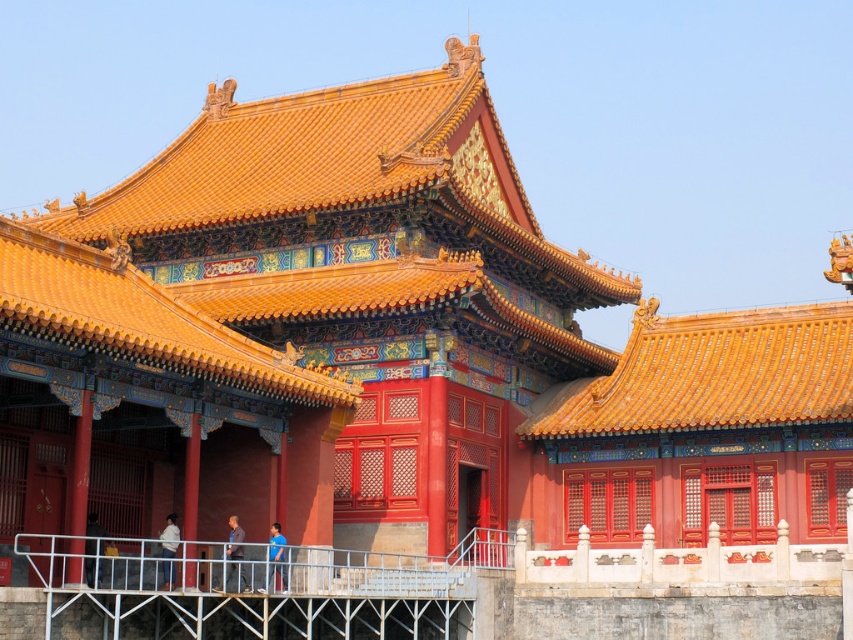
Question: Which point appears closest to the camera in this image?

Choices:
 (A) (260, 588)
 (B) (305, 550)
 (C) (167, 531)
 (D) (229, 556)

Answer: (A)

Question: Which is farther from the metallic gray railing at lower center?

Choices:
 (A) dark blue shirt at center
 (B) white fabric at lower left
 (C) blue fabric shirt at center
 (D) matte black person at lower left

Answer: (A)

Question: Is blue fabric shirt at center bigger than white fabric at lower left?

Choices:
 (A) no
 (B) yes

Answer: (B)

Question: Where is blue fabric shirt at center located in relation to matte black person at lower left in the image?

Choices:
 (A) above
 (B) below

Answer: (B)

Question: Which point appears closest to the camera in this image?

Choices:
 (A) (86, 564)
 (B) (236, 532)
 (C) (462, 612)

Answer: (A)

Question: Does matte black person at lower left appear under dark blue shirt at center?

Choices:
 (A) no
 (B) yes

Answer: (B)